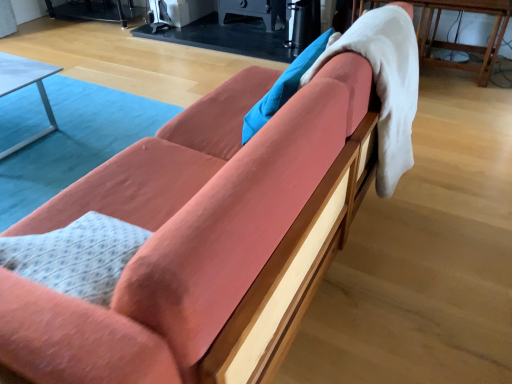
Question: Does wooden table at right, the 2th table from the left, turn towards metallic silver table at left, placed as the 2th table when sorted from top to bottom?

Choices:
 (A) yes
 (B) no

Answer: (B)

Question: Is wooden table at right, the 1th table positioned from the right, taller than metallic silver table at left, placed as the 2th table when sorted from top to bottom?

Choices:
 (A) no
 (B) yes

Answer: (B)

Question: From the image's perspective, is wooden table at right, the 1th table viewed from the top, above metallic silver table at left, which ranks as the first table in bottom-to-top order?

Choices:
 (A) no
 (B) yes

Answer: (B)

Question: Is wooden table at right, the 2th table from the left, positioned before metallic silver table at left, the 1th table from the left?

Choices:
 (A) yes
 (B) no

Answer: (B)

Question: From a real-world perspective, does wooden table at right, the 1th table viewed from the top, stand above metallic silver table at left, which ranks as the second table in right-to-left order?

Choices:
 (A) yes
 (B) no

Answer: (A)

Question: In terms of height, does metallic silver table at left, the 1th table from the left, look taller or shorter compared to white fluffy blanket at upper right?

Choices:
 (A) short
 (B) tall

Answer: (A)

Question: Would you say metallic silver table at left, the 1th table from the left, is to the left or to the right of white fluffy blanket at upper right in the picture?

Choices:
 (A) left
 (B) right

Answer: (A)

Question: Would you say metallic silver table at left, which ranks as the second table in right-to-left order, is inside or outside white fluffy blanket at upper right?

Choices:
 (A) outside
 (B) inside

Answer: (A)

Question: From a real-world perspective, is metallic silver table at left, the 1th table from the left, positioned above or below white fluffy blanket at upper right?

Choices:
 (A) above
 (B) below

Answer: (B)

Question: Considering the positions of wooden table at right, the 2th table from the left, and white fluffy blanket at upper right in the image, is wooden table at right, the 2th table from the left, wider or thinner than white fluffy blanket at upper right?

Choices:
 (A) wide
 (B) thin

Answer: (A)

Question: Is wooden table at right, the 1th table viewed from the top, inside the boundaries of white fluffy blanket at upper right, or outside?

Choices:
 (A) outside
 (B) inside

Answer: (A)

Question: Considering the positions of wooden table at right, the 1th table viewed from the top, and white fluffy blanket at upper right in the image, is wooden table at right, the 1th table viewed from the top, taller or shorter than white fluffy blanket at upper right?

Choices:
 (A) short
 (B) tall

Answer: (A)

Question: Based on their sizes in the image, would you say wooden table at right, the 1th table positioned from the right, is bigger or smaller than white fluffy blanket at upper right?

Choices:
 (A) small
 (B) big

Answer: (B)

Question: From the image's perspective, relative to metallic silver table at left, placed as the 2th table when sorted from top to bottom, is white fluffy blanket at upper right above or below?

Choices:
 (A) below
 (B) above

Answer: (A)

Question: Is white fluffy blanket at upper right taller or shorter than metallic silver table at left, which ranks as the second table in right-to-left order?

Choices:
 (A) short
 (B) tall

Answer: (B)